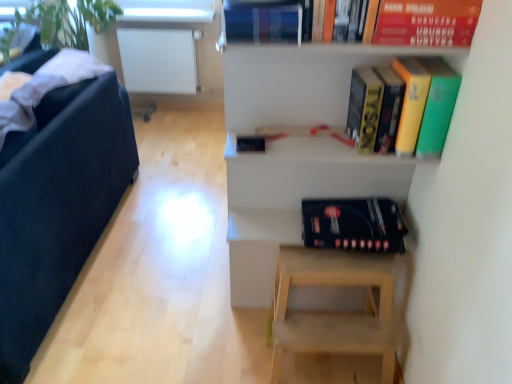
Question: From the image's perspective, relative to black matte album at lower center, is white matte radiator at upper left above or below?

Choices:
 (A) above
 (B) below

Answer: (A)

Question: Is white matte radiator at upper left wider or thinner than black matte album at lower center?

Choices:
 (A) thin
 (B) wide

Answer: (A)

Question: Which object is positioned farthest from the black matte album at lower center?

Choices:
 (A) orange matte paperback book at upper right, positioned as the second paperback book in left-to-right order
 (B) white matte radiator at upper left
 (C) black fabric armchair at left
 (D) white matte shelf at upper right
 (E) hardcover book at upper center, the 1th paperback book viewed from the left

Answer: (B)

Question: Based on their relative distances, which object is farther from the white matte radiator at upper left?

Choices:
 (A) orange matte paperback book at upper right, which appears as the first paperback book when viewed from the right
 (B) hardcover book at upper center, the 1th paperback book viewed from the left
 (C) hardcover book at upper right
 (D) black fabric armchair at left
 (E) white matte shelf at upper right

Answer: (A)